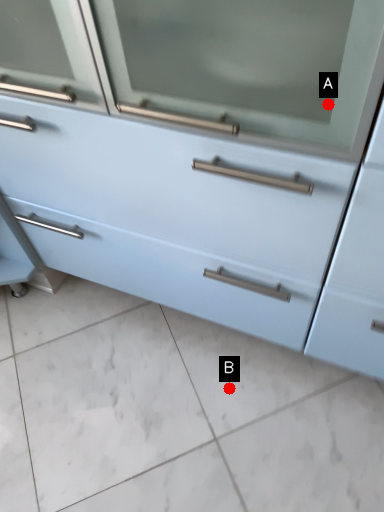
Question: Two points are circled on the image, labeled by A and B beside each circle. Which point is farther to the camera?

Choices:
 (A) A is further
 (B) B is further

Answer: (B)